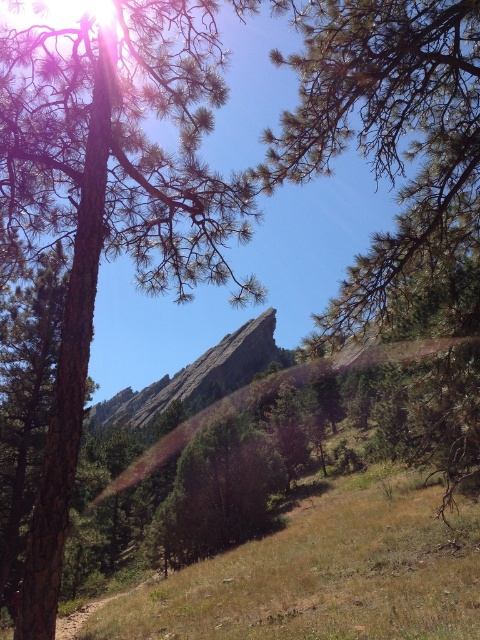
Does green rough bark tree at upper left have a lesser height compared to smooth gray rock at center?

Yes, green rough bark tree at upper left is shorter than smooth gray rock at center.

What do you see at coordinates (110, 202) in the screenshot? I see `green rough bark tree at upper left` at bounding box center [110, 202].

Between point (165, 243) and point (199, 397), which one is positioned in front?

Point (165, 243) is in front.

This screenshot has width=480, height=640. I want to click on green rough bark tree at upper left, so coord(110,202).

Does green textured pine tree at center have a larger size compared to smooth gray rock at center?

Actually, green textured pine tree at center might be smaller than smooth gray rock at center.

Between green textured pine tree at center and smooth gray rock at center, which one has less height?

With less height is green textured pine tree at center.

Which is in front, point (301, 116) or point (233, 364)?

Point (301, 116)

The width and height of the screenshot is (480, 640). Find the location of `green textured pine tree at center`. green textured pine tree at center is located at coordinates (392, 144).

Which of these two, green rough bark tree at upper left or green textured pine tree at center, stands shorter?

green rough bark tree at upper left is shorter.

Does green rough bark tree at upper left have a smaller size compared to green textured pine tree at center?

Yes.

Is point (49, 48) positioned behind point (419, 56)?

That is True.

The width and height of the screenshot is (480, 640). I want to click on green rough bark tree at upper left, so pyautogui.click(x=110, y=202).